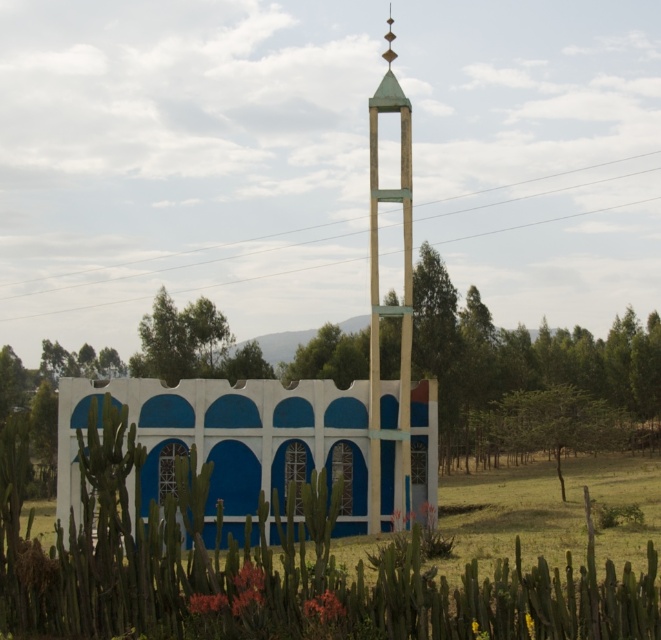
You are an architect analyzing the structure. From your perspective, which object is taller between the blue painted concrete wall at center and the green matte tower at center?

The green matte tower at center is taller than the blue painted concrete wall at center.

You are a landscape architect designing a garden around the green spiky cactus at center and the blue painted concrete wall at center. Which object will require more space to accommodate its size?

The green spiky cactus at center has a larger size compared to the blue painted concrete wall at center, so it will require more space to accommodate its size.